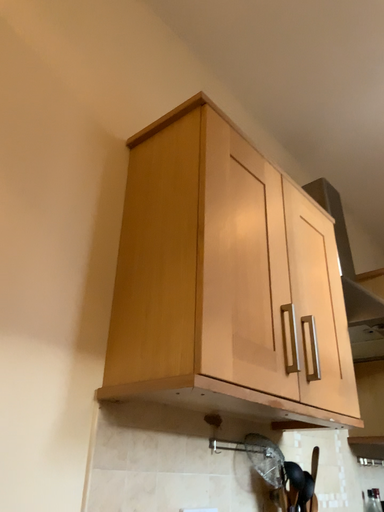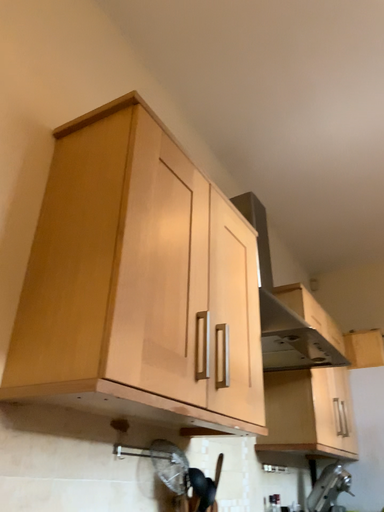
Question: How did the camera likely rotate when shooting the video?

Choices:
 (A) rotated left
 (B) rotated right

Answer: (B)